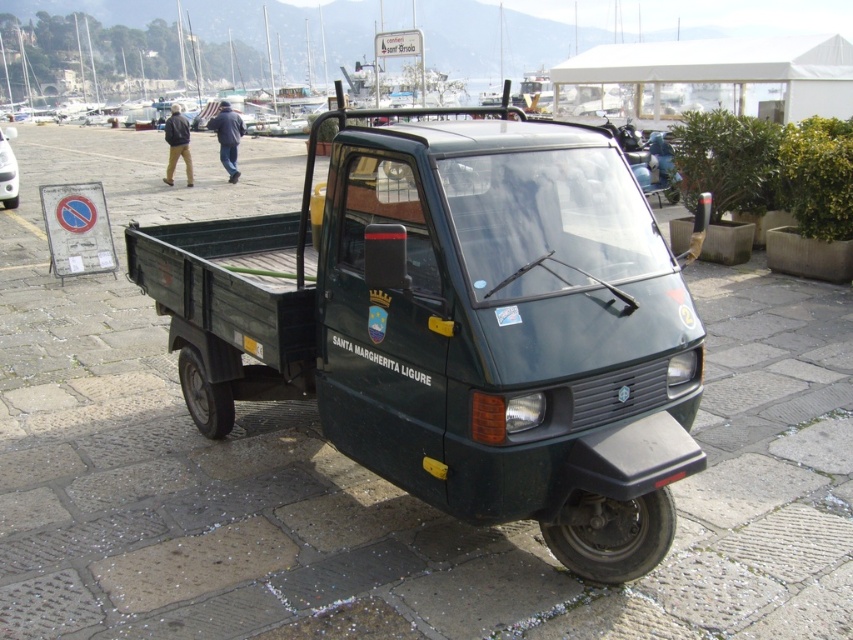
Which is more to the left, green matte pickup truck at center or matte green truck at center?

matte green truck at center

Identify the location of green matte pickup truck at center. (457, 326).